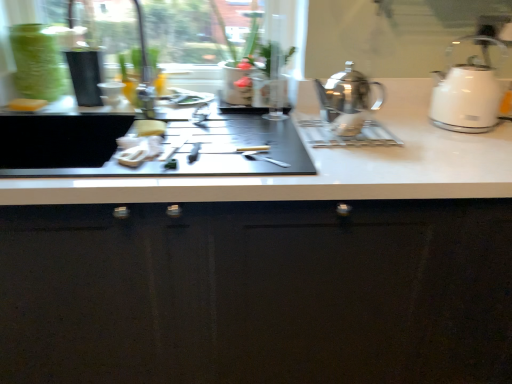
Identify the location of vacant space that is to the left of shiny metallic kettle at center, which appears as the first kettle when viewed from the left. This screenshot has width=512, height=384. (280, 133).